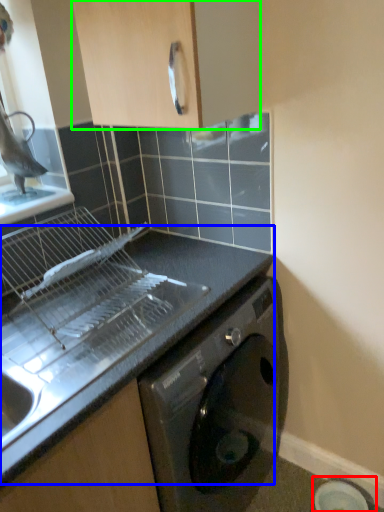
Question: Which is farther away from appliance (highlighted by a red box)? countertop (highlighted by a blue box) or cabinetry (highlighted by a green box)?

Choices:
 (A) countertop
 (B) cabinetry

Answer: (B)